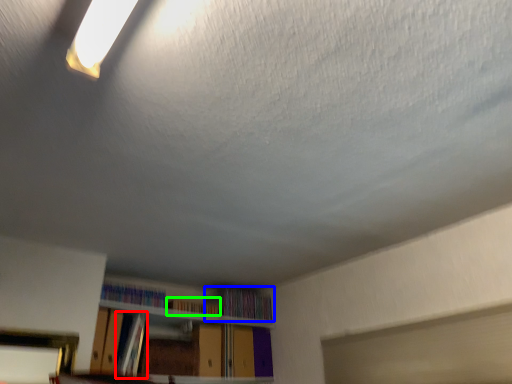
Question: Estimate the real-world distances between objects in this image. Which object is farther from book (highlighted by a red box), book (highlighted by a blue box) or book (highlighted by a green box)?

Choices:
 (A) book
 (B) book

Answer: (A)